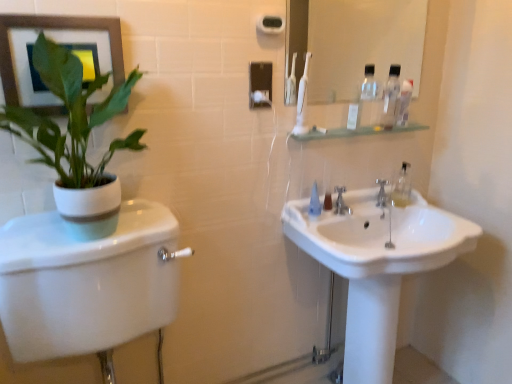
Find the location of a particular element. The image size is (512, 384). white plastic towel bar at upper center is located at coordinates coord(271,24).

Image resolution: width=512 pixels, height=384 pixels. Describe the element at coordinates (271, 24) in the screenshot. I see `white plastic towel bar at upper center` at that location.

Measure the distance between white plastic toothbrush at upper center and camera.

2.44 meters.

At what (x,y) coordinates should I click in order to perform the action: click on white glossy sink at right. Please return your answer as a coordinate pair (x, y). Looking at the image, I should click on (377, 266).

What is the approximate width of white glossy sink at right?

It is 18.39 inches.

Measure the distance between point (74, 349) and camera.

Point (74, 349) and camera are 3.84 feet apart.

What is the approximate height of white glossy toilet at left?

white glossy toilet at left is 29.48 inches tall.

What are the coordinates of `white plastic towel bar at upper center` in the screenshot? It's located at (271, 24).

Would you consider green matte plant at left to be distant from clear plastic mouthwash at upper right, the 2th mouthwash positioned from the front?

Yes, green matte plant at left and clear plastic mouthwash at upper right, the 2th mouthwash positioned from the front, are located far from each other.

Considering the relative positions of green matte plant at left and clear plastic mouthwash at upper right, the 1th mouthwash positioned from the right, in the image provided, is green matte plant at left behind clear plastic mouthwash at upper right, the 1th mouthwash positioned from the right,?

No, it is in front of clear plastic mouthwash at upper right, the 1th mouthwash positioned from the right.

Could clear plastic mouthwash at upper right, which is the 2th mouthwash in left-to-right order, be considered to be inside green matte plant at left?

That's incorrect, clear plastic mouthwash at upper right, which is the 2th mouthwash in left-to-right order, is not inside green matte plant at left.

How different are the orientations of green matte plant at left and clear plastic mouthwash at upper right, the 1th mouthwash positioned from the right, in degrees?

The angle between the facing direction of green matte plant at left and the facing direction of clear plastic mouthwash at upper right, the 1th mouthwash positioned from the right, is 3.72 degrees.

How much distance is there between matte gray picture frame at upper left and clear plastic bottle at upper right?

A distance of 3.64 feet exists between matte gray picture frame at upper left and clear plastic bottle at upper right.

Looking at this image, is clear plastic bottle at upper right at the back of matte gray picture frame at upper left?

No, matte gray picture frame at upper left is not facing away from clear plastic bottle at upper right.

In terms of height, does matte gray picture frame at upper left look taller or shorter compared to clear plastic bottle at upper right?

Considering their sizes, matte gray picture frame at upper left has more height than clear plastic bottle at upper right.

Is point (9, 27) less distant than point (387, 116)?

Yes, point (9, 27) is closer to viewer.

Does clear plastic mouthwash at upper right, the 1th mouthwash positioned from the right, have a lesser height compared to clear plastic bottle at upper right?

Correct, clear plastic mouthwash at upper right, the 1th mouthwash positioned from the right, is not as tall as clear plastic bottle at upper right.

Considering the relative positions of clear plastic mouthwash at upper right, which is the 2th mouthwash in left-to-right order, and clear plastic bottle at upper right in the image provided, is clear plastic mouthwash at upper right, which is the 2th mouthwash in left-to-right order, to the right of clear plastic bottle at upper right from the viewer's perspective?

Indeed, clear plastic mouthwash at upper right, which is the 2th mouthwash in left-to-right order, is positioned on the right side of clear plastic bottle at upper right.

This screenshot has width=512, height=384. In order to click on the 1st mouthwash positioned below the clear plastic bottle at upper right (from the image's perspective) in this screenshot , I will do `click(404, 102)`.

Is point (317, 215) positioned in front of point (383, 179)?

That is True.

Which object is more forward, transparent plastic mouthwash at center, which appears as the 1th mouthwash when ordered from the bottom, or silver metallic faucet at center, placed as the 2th tap when sorted from front to back?

transparent plastic mouthwash at center, which appears as the 1th mouthwash when ordered from the bottom.

Considering the relative sizes of transparent plastic mouthwash at center, positioned as the 2th mouthwash in top-to-bottom order, and silver metallic faucet at center, the second tap positioned from the left, in the image provided, is transparent plastic mouthwash at center, positioned as the 2th mouthwash in top-to-bottom order, bigger than silver metallic faucet at center, the second tap positioned from the left,?

Yes.

Is transparent plastic mouthwash at center, the second mouthwash when ordered from right to left, inside the boundaries of silver metallic faucet at center, the 1th tap viewed from the right, or outside?

transparent plastic mouthwash at center, the second mouthwash when ordered from right to left, is outside silver metallic faucet at center, the 1th tap viewed from the right.

Considering the positions of point (314, 204) and point (145, 291), is point (314, 204) closer or farther from the camera than point (145, 291)?

Clearly, point (314, 204) is more distant from the camera than point (145, 291).

Which object is closer to the camera taking this photo, transparent plastic mouthwash at center, the second mouthwash when ordered from right to left, or white glossy toilet at left?

white glossy toilet at left is in front.

Considering the sizes of transparent plastic mouthwash at center, which appears as the 1th mouthwash when ordered from the bottom, and white glossy toilet at left in the image, is transparent plastic mouthwash at center, which appears as the 1th mouthwash when ordered from the bottom, wider or thinner than white glossy toilet at left?

transparent plastic mouthwash at center, which appears as the 1th mouthwash when ordered from the bottom, is thinner than white glossy toilet at left.

Could you tell me if transparent plastic mouthwash at center, the 1th mouthwash when ordered from left to right, is facing white glossy toilet at left?

No, transparent plastic mouthwash at center, the 1th mouthwash when ordered from left to right, is not aimed at white glossy toilet at left.

From a real-world perspective, is green matte plant at left on top of white plastic towel bar at upper center?

Actually, green matte plant at left is physically below white plastic towel bar at upper center in the real world.

Can you confirm if green matte plant at left is wider than white plastic towel bar at upper center?

Yes, green matte plant at left is wider than white plastic towel bar at upper center.

Is green matte plant at left positioned behind white plastic towel bar at upper center?

No, the depth of green matte plant at left is less than that of white plastic towel bar at upper center.

From the image's perspective, which is below, transparent plastic mouthwash at center, placed as the first mouthwash when sorted from front to back, or matte gray picture frame at upper left?

transparent plastic mouthwash at center, placed as the first mouthwash when sorted from front to back, appears lower in the image.

Is there a large distance between transparent plastic mouthwash at center, placed as the 2th mouthwash when sorted from back to front, and matte gray picture frame at upper left?

Actually, transparent plastic mouthwash at center, placed as the 2th mouthwash when sorted from back to front, and matte gray picture frame at upper left are a little close together.

Does transparent plastic mouthwash at center, which appears as the 1th mouthwash when ordered from the bottom, have a smaller size compared to matte gray picture frame at upper left?

Correct, transparent plastic mouthwash at center, which appears as the 1th mouthwash when ordered from the bottom, occupies less space than matte gray picture frame at upper left.

The height and width of the screenshot is (384, 512). Find the location of `mouthwash that is the 2nd one when counting rightward from the green matte plant at left`. mouthwash that is the 2nd one when counting rightward from the green matte plant at left is located at coordinates (404, 102).

The image size is (512, 384). I want to click on picture frame that appears on the left of clear plastic bottle at upper right, so click(x=55, y=28).

Which object lies nearer to the anchor point clear plastic bottle at upper right, white plastic towel bar at upper center or white glossy sink at right?

white glossy sink at right is positioned closer to the anchor clear plastic bottle at upper right.

Which object lies further to the anchor point white plastic towel bar at upper center, transparent plastic mouthwash at center, positioned as the 2th mouthwash in top-to-bottom order, or white plastic toothpaste tube at upper center?

transparent plastic mouthwash at center, positioned as the 2th mouthwash in top-to-bottom order, lies further to white plastic towel bar at upper center than the other object.

When comparing their distances from silver metallic faucet at center, the first tap positioned from the front, does white plastic toothpaste tube at upper center or white glossy sink at right seem closer?

white plastic toothpaste tube at upper center.

When comparing their distances from white glossy mirror at upper center, does clear plastic bottle at upper right or green matte plant at left seem further?

The object further to white glossy mirror at upper center is green matte plant at left.

Based on their spatial positions, is silver metallic faucet at center, which is counted as the 1th tap, starting from the left, or silver metallic faucet at center, the second tap positioned from the left, further from transparent plastic mouthwash at center, which appears as the 1th mouthwash when ordered from the bottom?

silver metallic faucet at center, the second tap positioned from the left, is further to transparent plastic mouthwash at center, which appears as the 1th mouthwash when ordered from the bottom.

From the image, which object appears to be farther from white glossy toilet at left, green matte plant at left or white plastic toothpaste tube at upper center?

white plastic toothpaste tube at upper center lies further to white glossy toilet at left than the other object.

From the picture: Based on their spatial positions, is matte gray picture frame at upper left or white glossy sink at right closer to silver metallic faucet at center, the first tap positioned from the front?

Among the two, white glossy sink at right is located nearer to silver metallic faucet at center, the first tap positioned from the front.

From the image, which object appears to be farther from clear plastic mouthwash at upper right, which is the 1th mouthwash from top to bottom, white plastic towel bar at upper center or matte gray picture frame at upper left?

matte gray picture frame at upper left is positioned further to the anchor clear plastic mouthwash at upper right, which is the 1th mouthwash from top to bottom.

The image size is (512, 384). I want to click on mirror located between matte gray picture frame at upper left and white glossy sink at right in the left-right direction, so click(354, 42).

Where is `houseplant situated between matte gray picture frame at upper left and silver metallic faucet at center, acting as the first tap starting from the back, from left to right`? The width and height of the screenshot is (512, 384). houseplant situated between matte gray picture frame at upper left and silver metallic faucet at center, acting as the first tap starting from the back, from left to right is located at coordinates (70, 117).

The height and width of the screenshot is (384, 512). What are the coordinates of `bottle between white plastic towel bar at upper center and white glossy sink at right vertically` in the screenshot? It's located at (391, 97).

I want to click on houseplant located between matte gray picture frame at upper left and silver metallic faucet at center, the second tap in the right-to-left sequence, in the left-right direction, so click(70, 117).